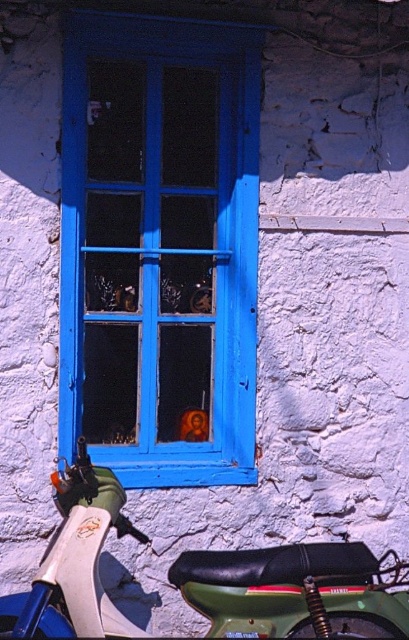
Does blue painted wood at center have a larger size compared to green matte motorcycle at lower left?

Yes, blue painted wood at center is bigger than green matte motorcycle at lower left.

Who is more forward, (154, 113) or (397, 563)?

Point (154, 113) is in front.

Is point (89, 99) in front of point (330, 589)?

No, (89, 99) is behind (330, 589).

This screenshot has height=640, width=409. I want to click on blue painted wood at center, so pyautogui.click(x=159, y=248).